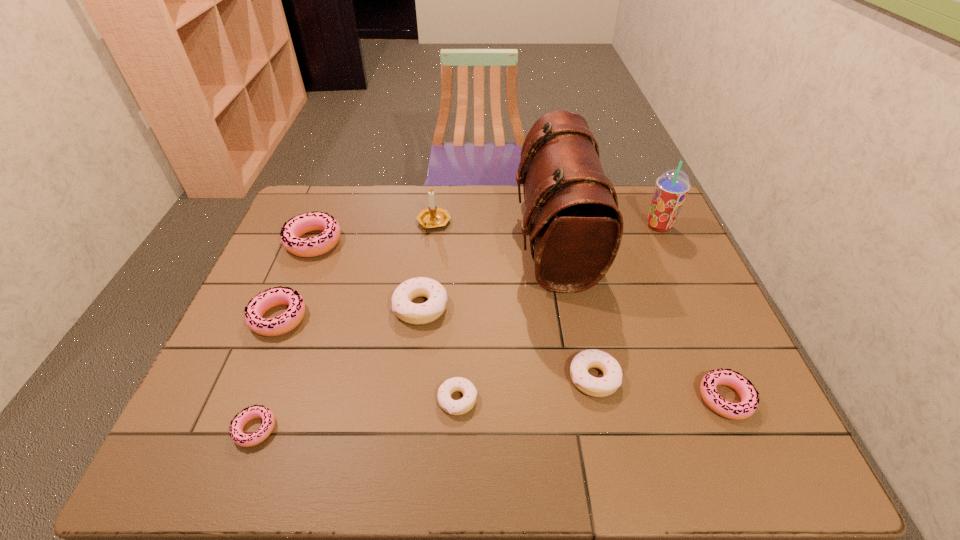
Image resolution: width=960 pixels, height=540 pixels. In order to click on vacant space that satisfies the following two spatial constraints: 1. on the front side of the third smallest pink doughnut; 2. on the left side of the sixth doughnut from left to right in this screenshot , I will do `click(253, 377)`.